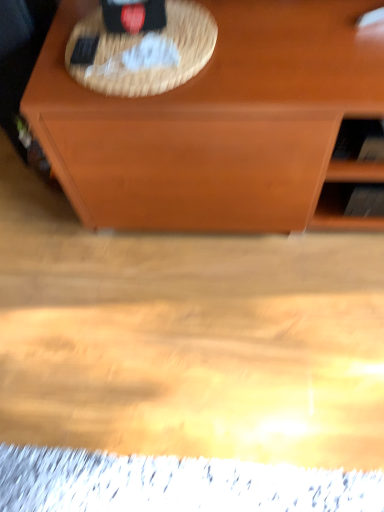
Question: Based on their positions, is woven straw picnic basket at upper center located to the left or right of wooden shelf at right?

Choices:
 (A) left
 (B) right

Answer: (A)

Question: Considering the positions of woven straw picnic basket at upper center and wooden shelf at right in the image, is woven straw picnic basket at upper center wider or thinner than wooden shelf at right?

Choices:
 (A) wide
 (B) thin

Answer: (A)

Question: Considering the positions of woven straw picnic basket at upper center and wooden shelf at right in the image, is woven straw picnic basket at upper center bigger or smaller than wooden shelf at right?

Choices:
 (A) big
 (B) small

Answer: (B)

Question: From the image's perspective, is wooden shelf at right located above or below woven straw picnic basket at upper center?

Choices:
 (A) above
 (B) below

Answer: (B)

Question: From a real-world perspective, is wooden shelf at right above or below woven straw picnic basket at upper center?

Choices:
 (A) below
 (B) above

Answer: (A)

Question: Considering the positions of wooden shelf at right and woven straw picnic basket at upper center in the image, is wooden shelf at right wider or thinner than woven straw picnic basket at upper center?

Choices:
 (A) wide
 (B) thin

Answer: (B)

Question: In terms of height, does wooden shelf at right look taller or shorter compared to woven straw picnic basket at upper center?

Choices:
 (A) tall
 (B) short

Answer: (A)